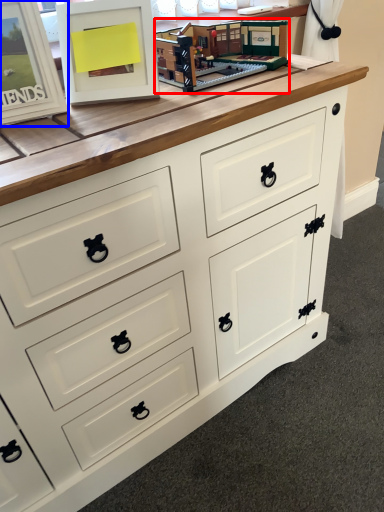
Question: Which of the following is the closest to the observer, toy (highlighted by a red box) or picture frame (highlighted by a blue box)?

Choices:
 (A) toy
 (B) picture frame

Answer: (B)